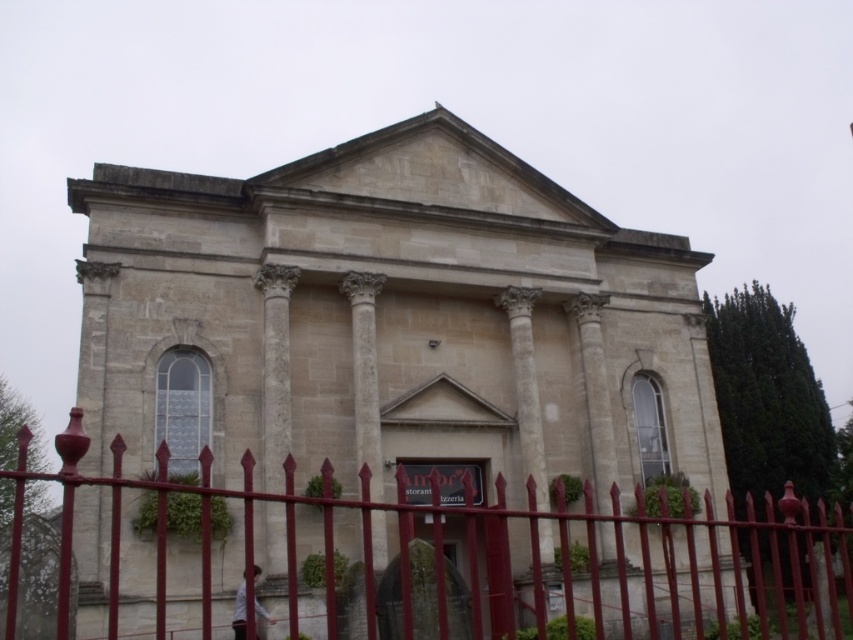
You are standing in front of the classical building and want to walk towards the white stone column at center. Which direction should you move relative to the smooth metal fence at center?

You should move to the right relative to the smooth metal fence at center because the smooth metal fence at center is to the left of the white stone column at center.